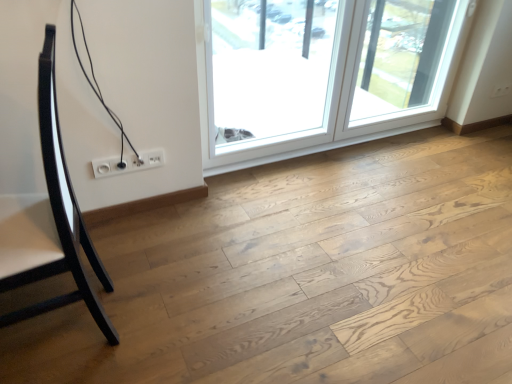
Identify the location of vacant area located to the right-hand side of glossy black chair at left. (168, 314).